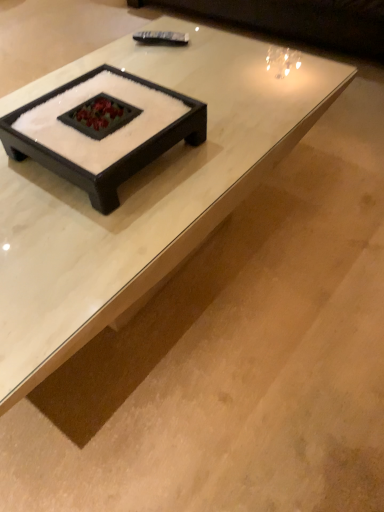
Locate an element on the screen. Image resolution: width=384 pixels, height=512 pixels. white glossy coffee table at center is located at coordinates (140, 194).

This screenshot has height=512, width=384. What do you see at coordinates (140, 194) in the screenshot?
I see `white glossy coffee table at center` at bounding box center [140, 194].

Measure the distance between point (241, 1) and camera.

Point (241, 1) and camera are 2.41 meters apart.

The width and height of the screenshot is (384, 512). Identify the location of dark brown leather couch at upper center. (297, 20).

What do you see at coordinates (297, 20) in the screenshot? This screenshot has height=512, width=384. I see `dark brown leather couch at upper center` at bounding box center [297, 20].

I want to click on white glossy coffee table at center, so click(140, 194).

Does white glossy coffee table at center appear on the right side of dark brown leather couch at upper center?

In fact, white glossy coffee table at center is to the left of dark brown leather couch at upper center.

Is white glossy coffee table at center further to the viewer compared to dark brown leather couch at upper center?

No, the depth of white glossy coffee table at center is less than that of dark brown leather couch at upper center.

Which point is more forward, (303, 110) or (356, 47)?

The point (303, 110) is in front.

From the image's perspective, relative to dark brown leather couch at upper center, is white glossy coffee table at center above or below?

white glossy coffee table at center is situated lower than dark brown leather couch at upper center in the image.

From a real-world perspective, which object stands above the other?

In real-world perspective, white glossy coffee table at center is above.

Which object is thinner, white glossy coffee table at center or dark brown leather couch at upper center?

With smaller width is white glossy coffee table at center.

Can you confirm if white glossy coffee table at center is taller than dark brown leather couch at upper center?

Indeed, white glossy coffee table at center has a greater height compared to dark brown leather couch at upper center.

Considering the sizes of white glossy coffee table at center and dark brown leather couch at upper center in the image, is white glossy coffee table at center bigger or smaller than dark brown leather couch at upper center?

Considering their sizes, white glossy coffee table at center takes up less space than dark brown leather couch at upper center.

Choose the correct answer: Is white glossy coffee table at center inside dark brown leather couch at upper center or outside it?

white glossy coffee table at center cannot be found inside dark brown leather couch at upper center.

Is white glossy coffee table at center far from dark brown leather couch at upper center?

white glossy coffee table at center is far away from dark brown leather couch at upper center.

Is white glossy coffee table at center looking in the opposite direction of dark brown leather couch at upper center?

No, white glossy coffee table at center is not facing the opposite direction of dark brown leather couch at upper center.

Could you measure the distance between white glossy coffee table at center and dark brown leather couch at upper center?

white glossy coffee table at center and dark brown leather couch at upper center are 1.25 meters apart.

Where is `couch that is on the right side of white glossy coffee table at center`? couch that is on the right side of white glossy coffee table at center is located at coordinates (297, 20).

Is dark brown leather couch at upper center to the left or to the right of white glossy coffee table at center in the image?

dark brown leather couch at upper center is positioned on white glossy coffee table at center's right side.

Which object is further away from the camera taking this photo, dark brown leather couch at upper center or white glossy coffee table at center?

dark brown leather couch at upper center is further away from the camera.

Is point (201, 8) closer or farther from the camera than point (132, 254)?

Point (201, 8) appears to be farther away from the viewer than point (132, 254).

From the image's perspective, is dark brown leather couch at upper center located beneath white glossy coffee table at center?

Actually, dark brown leather couch at upper center appears above white glossy coffee table at center in the image.

From a real-world perspective, relative to white glossy coffee table at center, is dark brown leather couch at upper center vertically above or below?

A: dark brown leather couch at upper center is below white glossy coffee table at center.

In terms of width, does dark brown leather couch at upper center look wider or thinner when compared to white glossy coffee table at center?

Clearly, dark brown leather couch at upper center has more width compared to white glossy coffee table at center.

Considering the sizes of dark brown leather couch at upper center and white glossy coffee table at center in the image, is dark brown leather couch at upper center taller or shorter than white glossy coffee table at center?

In the image, dark brown leather couch at upper center appears to be shorter than white glossy coffee table at center.

Considering the sizes of objects dark brown leather couch at upper center and white glossy coffee table at center in the image provided, who is smaller, dark brown leather couch at upper center or white glossy coffee table at center?

With smaller size is white glossy coffee table at center.

In the scene shown: Would you say dark brown leather couch at upper center is inside or outside white glossy coffee table at center?

dark brown leather couch at upper center is located beyond the bounds of white glossy coffee table at center.

Is there a large distance between dark brown leather couch at upper center and white glossy coffee table at center?

Absolutely, dark brown leather couch at upper center is distant from white glossy coffee table at center.

Is dark brown leather couch at upper center facing towards white glossy coffee table at center?

Yes, dark brown leather couch at upper center is turned towards white glossy coffee table at center.

What's the angular difference between dark brown leather couch at upper center and white glossy coffee table at center's facing directions?

They differ by 89.5 degrees in their facing directions.

How far apart are dark brown leather couch at upper center and white glossy coffee table at center?

dark brown leather couch at upper center is 1.25 meters away from white glossy coffee table at center.

Find the location of `coffee table above the dark brown leather couch at upper center (from a real-world perspective)`. coffee table above the dark brown leather couch at upper center (from a real-world perspective) is located at coordinates (140, 194).

Where is `couch that is behind the white glossy coffee table at center`? Image resolution: width=384 pixels, height=512 pixels. couch that is behind the white glossy coffee table at center is located at coordinates (297, 20).

Find the location of `coffee table on the left of dark brown leather couch at upper center`. coffee table on the left of dark brown leather couch at upper center is located at coordinates (140, 194).